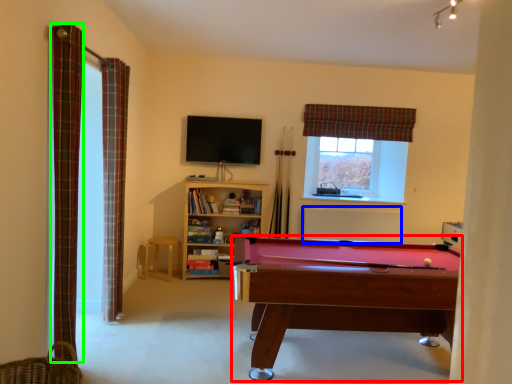
Question: Which object is positioned farthest from billiard table (highlighted by a red box)? Select from radiator (highlighted by a blue box) and curtain (highlighted by a green box).

Choices:
 (A) radiator
 (B) curtain

Answer: (A)